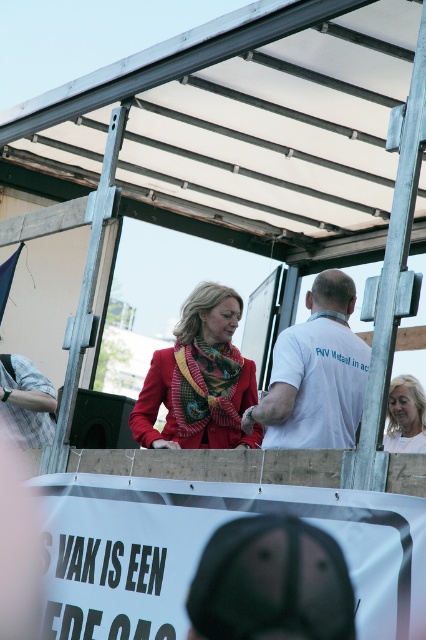
Looking at this image, what is located at the coordinates point (199,380)?

The point (199,380) indicates the location of the matte red coat at center.